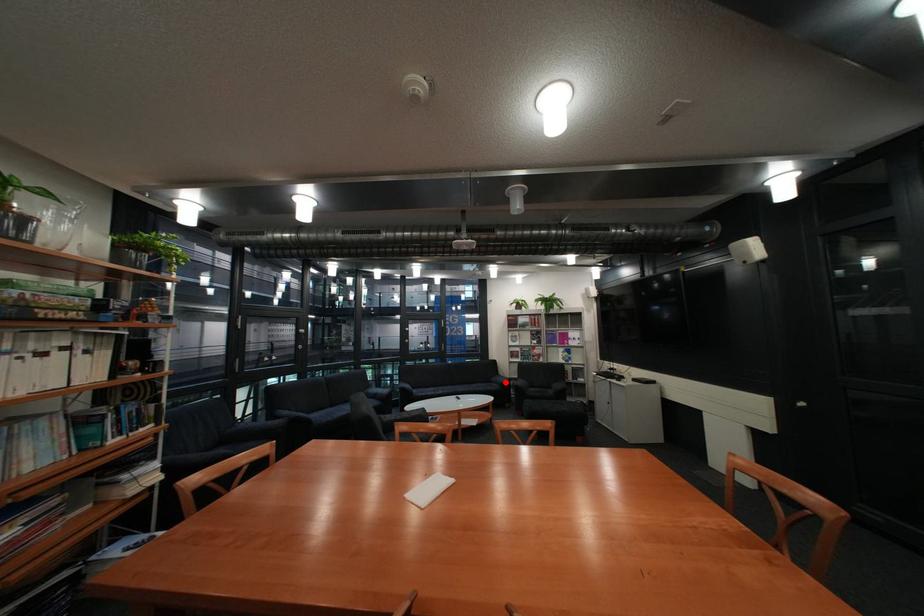
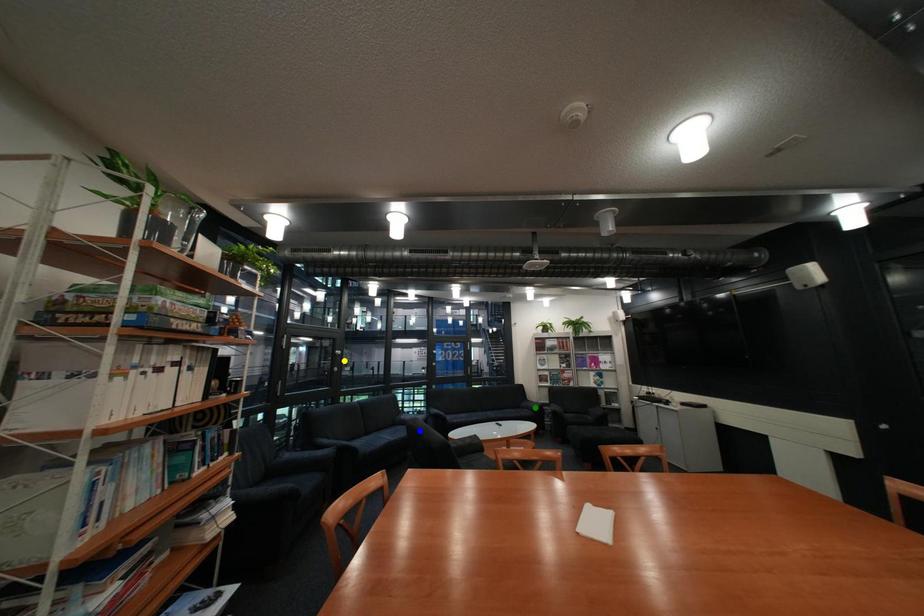
Question: I am providing you with two images of the same scene from different viewpoints. A red point is marked on the first image. You are given multiple points on the second image. Which spot in image 2 lines up with the point in image 1?

Choices:
 (A) blue point
 (B) green point
 (C) yellow point

Answer: (B)